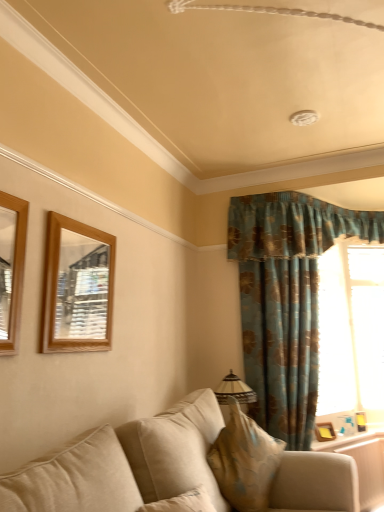
At what (x,y) coordinates should I click in order to perform the action: click on wooden frame at lower right. Please return your answer as a coordinate pair (x, y). This screenshot has height=512, width=384. Looking at the image, I should click on (350, 439).

Identify the location of wooden picture frame at right, marked as the 1th picture frame in a bottom-to-top arrangement. 361,421.

Locate an element on the screen. The height and width of the screenshot is (512, 384). wooden mirror at upper left, which appears as the 3th picture frame when viewed from the back is located at coordinates (77, 287).

You are a GUI agent. You are given a task and a screenshot of the screen. Output one action in this format:
    pyautogui.click(x=<x>, y=<y>)
    Task: Click on the wooden mirror at left, the fourth picture frame when ordered from right to left
    This screenshot has width=384, height=512.
    Given the screenshot: What is the action you would take?
    pyautogui.click(x=11, y=268)

Measure the distance between beige fabric pillow at lower center and wooden picture frame at right, arranged as the fourth picture frame when viewed from the top.

beige fabric pillow at lower center and wooden picture frame at right, arranged as the fourth picture frame when viewed from the top, are 1.67 meters apart.

Which is nearer, [226,432] or [363,416]?

The point [226,432] is closer to the camera.

From the picture: Does beige fabric pillow at lower center contain wooden picture frame at right, the 1th picture frame positioned from the back?

No, wooden picture frame at right, the 1th picture frame positioned from the back, is located outside of beige fabric pillow at lower center.

Can you confirm if beige fabric pillow at lower center is shorter than wooden picture frame at right, arranged as the first picture frame when viewed from the right?

In fact, beige fabric pillow at lower center may be taller than wooden picture frame at right, arranged as the first picture frame when viewed from the right.

From the image's perspective, between matte beige lampshade at center and wooden mirror at left, the 1th picture frame from the front, which one is located above?

wooden mirror at left, the 1th picture frame from the front.

From the matte beige lampshade at center, count the 2nd picture frame to the left and point to it. Please provide its 2D coordinates.

[(11, 268)]

Considering the sizes of objects matte beige lampshade at center and wooden mirror at left, the fourth picture frame when ordered from right to left, in the image provided, who is smaller, matte beige lampshade at center or wooden mirror at left, the fourth picture frame when ordered from right to left,?

With smaller size is wooden mirror at left, the fourth picture frame when ordered from right to left.

From a real-world perspective, does teal floral fabric curtain at right stand above wooden frame at lower right?

Yes, from a real-world perspective, teal floral fabric curtain at right is above wooden frame at lower right.

Would you say wooden frame at lower right is part of teal floral fabric curtain at right's contents?

Actually, wooden frame at lower right is outside teal floral fabric curtain at right.

Is teal floral fabric curtain at right facing towards wooden frame at lower right?

No, teal floral fabric curtain at right is not aimed at wooden frame at lower right.

Does beige fabric pillow at lower center appear on the left side of wooden mirror at left, the 1th picture frame from the front?

No.

How different are the orientations of beige fabric pillow at lower center and wooden mirror at left, arranged as the first picture frame when viewed from the left, in degrees?

They differ by 30.6 degrees in their facing directions.

From the image's perspective, would you say beige fabric pillow at lower center is positioned over wooden mirror at left, arranged as the first picture frame when viewed from the left?

No, from the image's perspective, beige fabric pillow at lower center is not above wooden mirror at left, arranged as the first picture frame when viewed from the left.

Between beige fabric pillow at lower center and wooden mirror at left, arranged as the fourth picture frame when viewed from the back, which one has smaller width?

With smaller width is wooden mirror at left, arranged as the fourth picture frame when viewed from the back.

From the beige fabric pillow at lower center, count 1st picture frames backward and point to it. Please provide its 2D coordinates.

[(77, 287)]

Considering the sizes of beige fabric pillow at lower center and wooden mirror at upper left, which appears as the 3th picture frame when viewed from the back, in the image, is beige fabric pillow at lower center wider or thinner than wooden mirror at upper left, which appears as the 3th picture frame when viewed from the back,?

Clearly, beige fabric pillow at lower center has more width compared to wooden mirror at upper left, which appears as the 3th picture frame when viewed from the back.

Can you tell me how much beige fabric pillow at lower center and wooden mirror at upper left, which appears as the 3th picture frame when viewed from the back, differ in facing direction?

They differ by 31 degrees in their facing directions.

How many degrees apart are the facing directions of wooden frame at lower right and beige fabric pillow at lower center?

There is a 58.5-degree angle between the facing directions of wooden frame at lower right and beige fabric pillow at lower center.

Is wooden frame at lower right in contact with beige fabric pillow at lower center?

No, wooden frame at lower right is not making contact with beige fabric pillow at lower center.

Looking at this image, based on their positions, is wooden frame at lower right located to the left or right of beige fabric pillow at lower center?

wooden frame at lower right is to the right of beige fabric pillow at lower center.

Which is behind, point (372, 425) or point (235, 451)?

The point (372, 425) is more distant.

Locate an element on the screen. picture frame that is the 1st object to the left of the teal floral fabric curtain at right, starting at the anchor is located at coordinates (77, 287).

Based on their positions, is teal floral fabric curtain at right located to the left or right of wooden mirror at upper left, positioned as the second picture frame in left-to-right order?

In the image, teal floral fabric curtain at right appears on the right side of wooden mirror at upper left, positioned as the second picture frame in left-to-right order.

From the image's perspective, which is above, teal floral fabric curtain at right or wooden mirror at upper left, positioned as the second picture frame in left-to-right order?

From the image's view, wooden mirror at upper left, positioned as the second picture frame in left-to-right order, is above.

Considering the relative sizes of teal floral fabric curtain at right and wooden mirror at upper left, which appears as the second picture frame when viewed from the front, in the image provided, is teal floral fabric curtain at right thinner than wooden mirror at upper left, which appears as the second picture frame when viewed from the front,?

In fact, teal floral fabric curtain at right might be wider than wooden mirror at upper left, which appears as the second picture frame when viewed from the front.

Identify the location of picture frame that is the 2nd one when counting downward from the beige fabric pillow at lower center (from the image's perspective). The height and width of the screenshot is (512, 384). (361, 421).

I want to click on lamp below the wooden mirror at left, the 1th picture frame from the front (from a real-world perspective), so click(x=234, y=394).

Based on the photo, looking at the image, which one is located closer to beige fabric pillow at lower center, wooden frame at lower right or wooden picture frame at lower right, positioned as the 2th picture frame in bottom-to-top order?

wooden frame at lower right is closer to beige fabric pillow at lower center.

Considering their positions, is wooden mirror at left, arranged as the first picture frame when viewed from the left, positioned further to beige fabric couch at lower center than wooden mirror at upper left, the second picture frame when ordered from top to bottom?

wooden mirror at left, arranged as the first picture frame when viewed from the left, lies further to beige fabric couch at lower center than the other object.

Which object lies further to the anchor point wooden picture frame at right, marked as the 1th picture frame in a bottom-to-top arrangement, wooden mirror at left, which is counted as the fourth picture frame, starting from the bottom, or beige fabric pillow at lower center?

wooden mirror at left, which is counted as the fourth picture frame, starting from the bottom.

Looking at the image, which one is located closer to transparent glass window at right, beige fabric couch at lower center or matte beige lampshade at center?

matte beige lampshade at center lies closer to transparent glass window at right than the other object.

Based on their spatial positions, is transparent glass window at right or beige fabric couch at lower center closer to wooden mirror at left, which appears as the 1th picture frame when viewed from the top?

Among the two, beige fabric couch at lower center is located nearer to wooden mirror at left, which appears as the 1th picture frame when viewed from the top.

Looking at the image, which one is located further to teal floral fabric curtain at right, wooden frame at lower right or wooden picture frame at lower right, the 3th picture frame positioned from the left?

wooden picture frame at lower right, the 3th picture frame positioned from the left, is positioned further to the anchor teal floral fabric curtain at right.

Which object lies nearer to the anchor point transparent glass window at right, wooden picture frame at lower right, the 3th picture frame from the front, or wooden frame at lower right?

Based on the image, wooden frame at lower right appears to be nearer to transparent glass window at right.

Looking at the image, which one is located closer to beige fabric pillow at lower center, transparent glass window at right or beige fabric couch at lower center?

The object closer to beige fabric pillow at lower center is beige fabric couch at lower center.

Where is `pillow between beige fabric couch at lower center and matte beige lampshade at center in the front-back direction`? pillow between beige fabric couch at lower center and matte beige lampshade at center in the front-back direction is located at coordinates (244, 461).

The height and width of the screenshot is (512, 384). Find the location of `lamp situated between wooden mirror at left, the 1th picture frame from the front, and wooden frame at lower right from left to right`. lamp situated between wooden mirror at left, the 1th picture frame from the front, and wooden frame at lower right from left to right is located at coordinates (234, 394).

Find the location of a particular element. Image resolution: width=384 pixels, height=512 pixels. curtain located between wooden mirror at upper left, positioned as the second picture frame in left-to-right order, and wooden frame at lower right in the left-right direction is located at coordinates (286, 298).

In order to click on picture frame between beige fabric couch at lower center and wooden mirror at upper left, the third picture frame in the bottom-to-top sequence, in the front-back direction in this screenshot , I will do `click(11, 268)`.